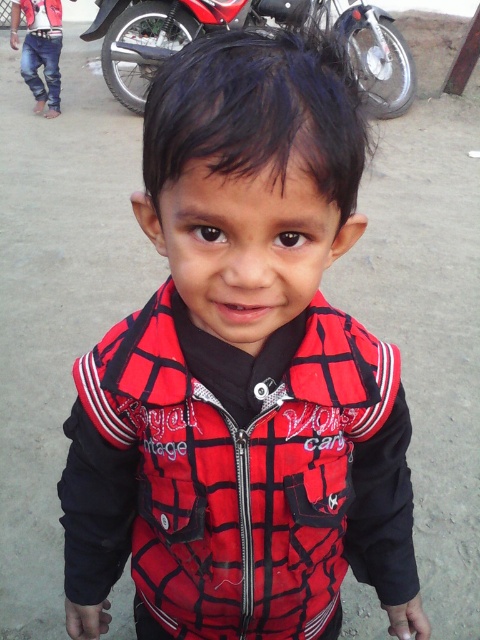
Question: Does metallic red motorcycle at upper center have a larger size compared to matte red vest at upper left?

Choices:
 (A) yes
 (B) no

Answer: (A)

Question: Can you confirm if metallic red motorcycle at upper center is positioned below matte red vest at upper left?

Choices:
 (A) no
 (B) yes

Answer: (B)

Question: Based on their relative distances, which object is nearer to the metallic red motorcycle at upper center?

Choices:
 (A) matte red vest at upper left
 (B) jeans at left

Answer: (B)

Question: Which of these objects is positioned closest to the matte red vest at upper left?

Choices:
 (A) metallic red motorcycle at upper center
 (B) jeans at left

Answer: (B)

Question: Considering the relative positions of jeans at left and matte red vest at upper left in the image provided, where is jeans at left located with respect to matte red vest at upper left?

Choices:
 (A) right
 (B) left

Answer: (B)

Question: Which object is closer to the camera taking this photo?

Choices:
 (A) metallic red motorcycle at upper center
 (B) matte red vest at upper left

Answer: (A)